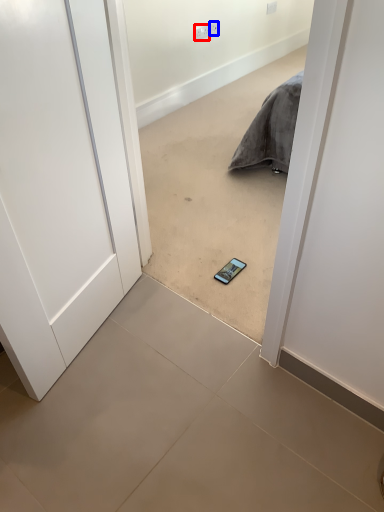
Question: Which object is closer to the camera taking this photo, electric outlet (highlighted by a red box) or electric outlet (highlighted by a blue box)?

Choices:
 (A) electric outlet
 (B) electric outlet

Answer: (A)